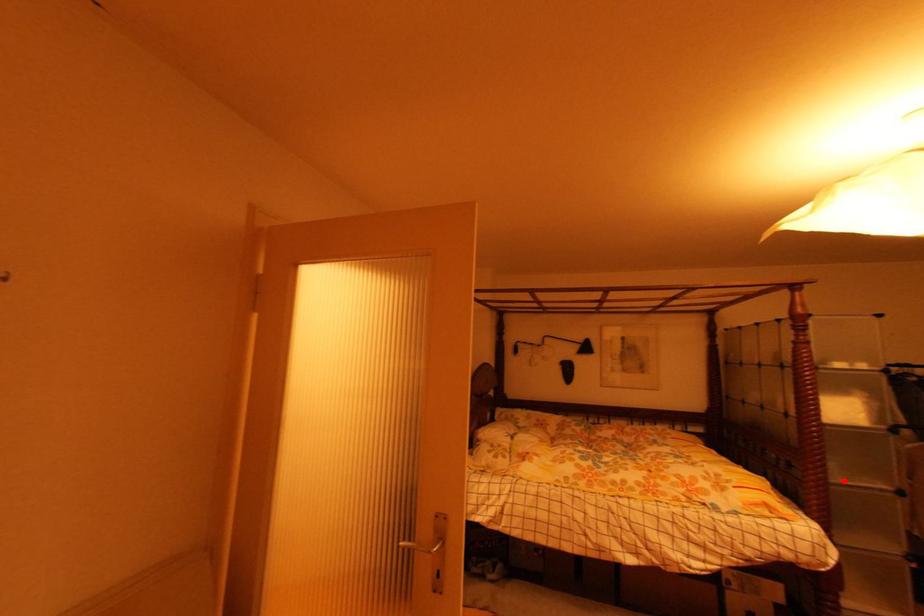
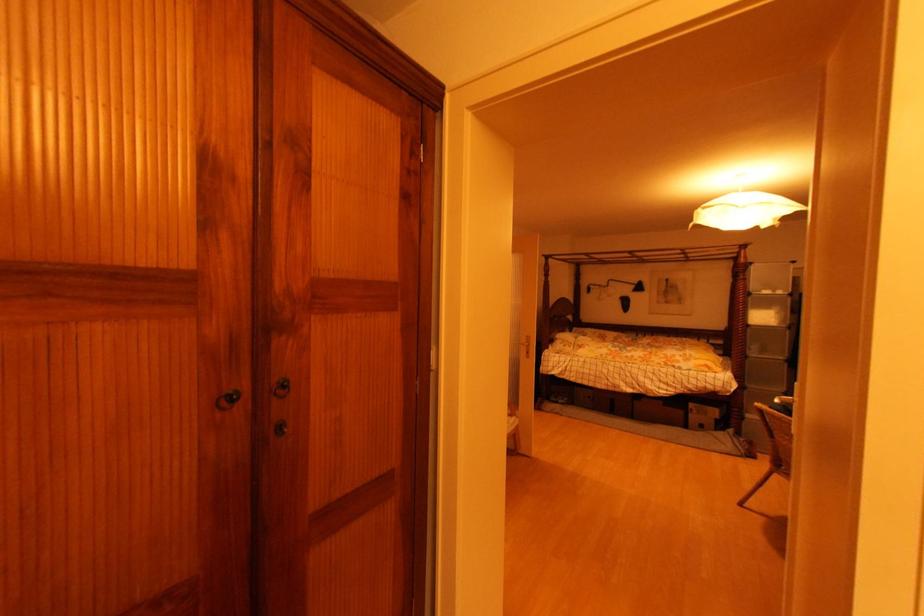
Question: I am providing you with two images of the same scene from different viewpoints. Image1 has a red point marked. In image2, the corresponding 3D location appears at what relative position? Reply with the corresponding letter.

Choices:
 (A) Closer
 (B) Farther

Answer: (B)